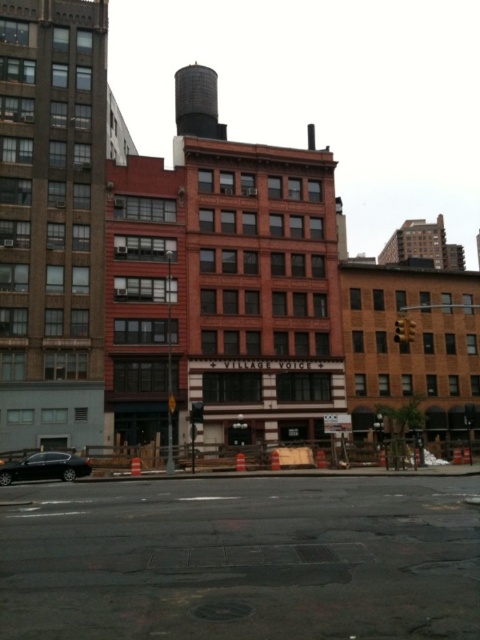
You are standing on the sidewalk in front of the Village Voice building and want to take a photo of the black textured water tower at upper center. If your camera can focus on objects up to 50 meters away, will you need to move closer to get a clear shot?

The black textured water tower at upper center is 55.50 meters away from the camera. Since your camera can only focus up to 50 meters, you need to move closer to ensure the water tower is within the camera range.

You are a city planner assessing the urban layout. You notice the black textured water tower at upper center and the shiny black sedan at lower left. Based on their sizes, which object would require more space for maintenance access?

The black textured water tower at upper center requires more space for maintenance access because it has a larger size compared to the shiny black sedan at lower left.

In the scene shown: You are a delivery person trying to park your van on the black asphalt at center. You notice the black textured water tower at upper center. Which side of the water tower should you position your van relative to it?

The black asphalt at center is on the right side of the black textured water tower at upper center, so you should position your van to the right of the water tower.